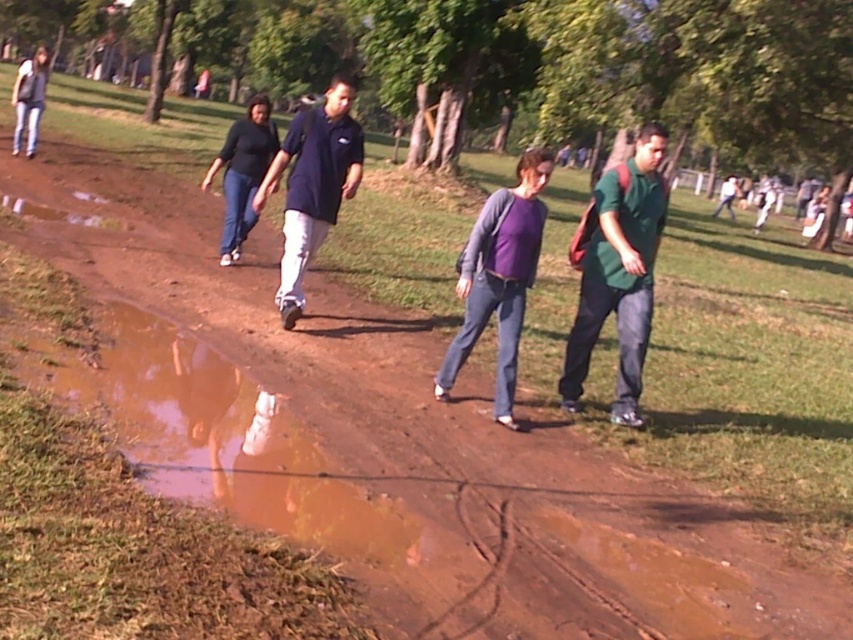
You are a photographer trying to capture a group photo of the green matte shirt at center and the dark blue shirt at center. Given that your camera can only focus on objects within a 2 meter width, will both individuals fit within the frame if they stand side by side?

The green matte shirt at center is narrower than the dark blue shirt at center. However, since the total width of both individuals together may exceed 2 meters, it depends on their combined width. The description only provides a comparison between their widths, not exact measurements. Without knowing the exact width of either, we cannot confirm if their combined width is within the 2 meter limit.

You are a photographer standing behind the group of people walking towards you. You want to take a photo that includes both the green matte shirt at center and the purple matte shirt at center. Which shirt should you adjust your focus to ensure the one in front is captured clearly?

The green matte shirt at center is located above the purple matte shirt at center, meaning it is closer to you. To ensure the one in front is captured clearly, focus on the green matte shirt at center since it is nearer.